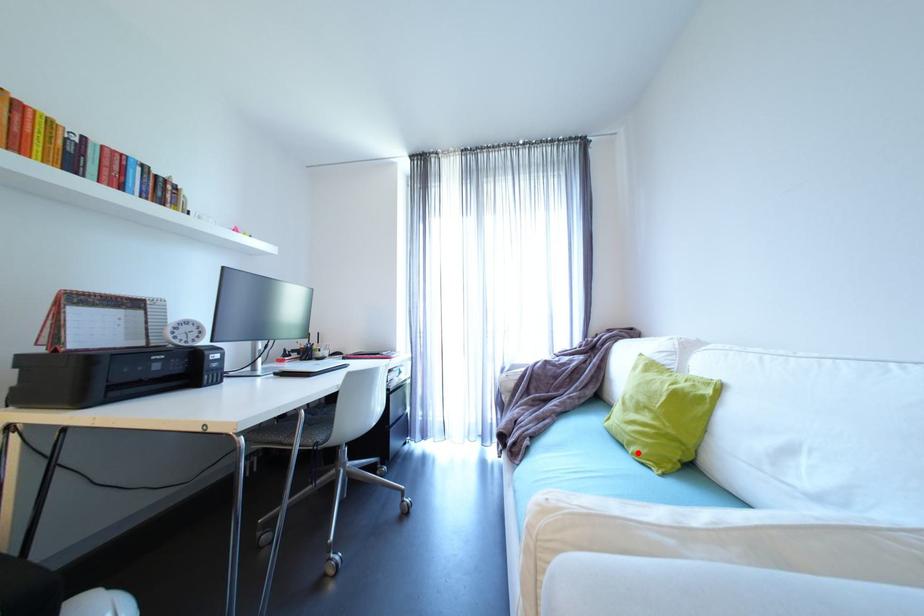
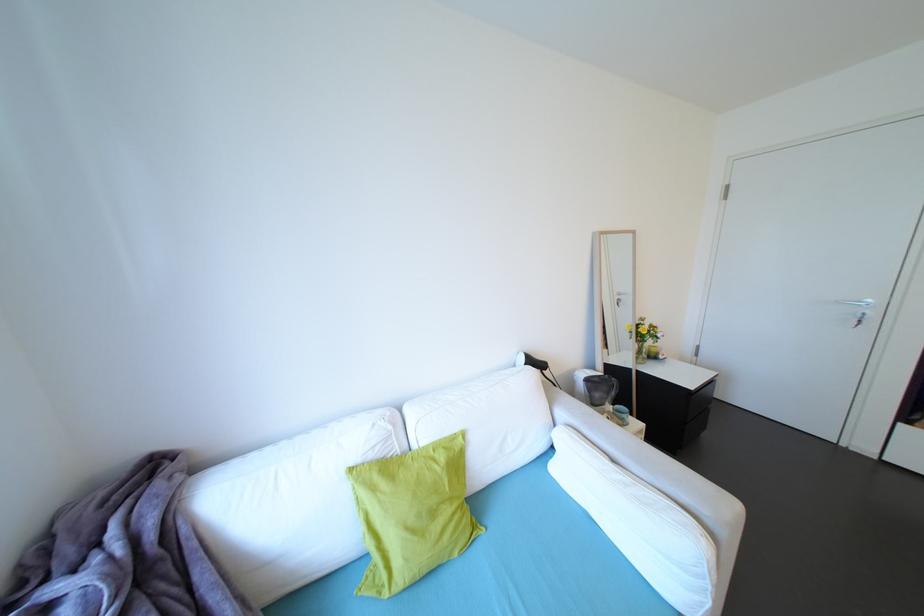
Question: I am providing you with two images of the same scene from different viewpoints. Image1 has a red point marked. In image2, the corresponding 3D location appears at what relative position? Reply with the corresponding letter.

Choices:
 (A) Closer
 (B) Farther

Answer: (B)